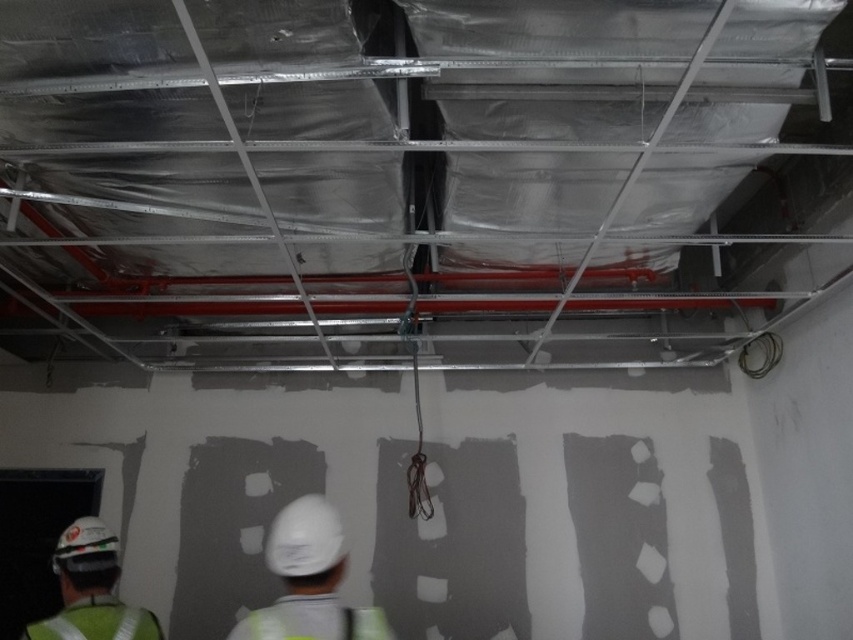
Question: Does white matte hard hat at center appear over green reflective safety vest at lower left?

Choices:
 (A) yes
 (B) no

Answer: (A)

Question: Which of these objects is positioned farthest from the green reflective safety vest at lower left?

Choices:
 (A) white matte hard hat at center
 (B) white hard hat at lower left

Answer: (A)

Question: Is white matte hard hat at center further to camera compared to white hard hat at lower left?

Choices:
 (A) yes
 (B) no

Answer: (B)

Question: Does white matte hard hat at center have a larger size compared to green reflective safety vest at lower left?

Choices:
 (A) yes
 (B) no

Answer: (A)

Question: Which point is farther to the camera?

Choices:
 (A) (334, 515)
 (B) (90, 632)
 (C) (99, 611)

Answer: (A)

Question: Which is nearer to the white matte hard hat at center?

Choices:
 (A) green reflective safety vest at lower left
 (B) white hard hat at lower left

Answer: (A)